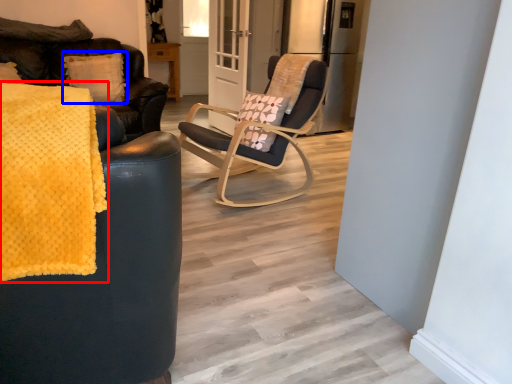
Question: Which object appears farthest to the camera in this image, blanket (highlighted by a red box) or pillow (highlighted by a blue box)?

Choices:
 (A) blanket
 (B) pillow

Answer: (B)